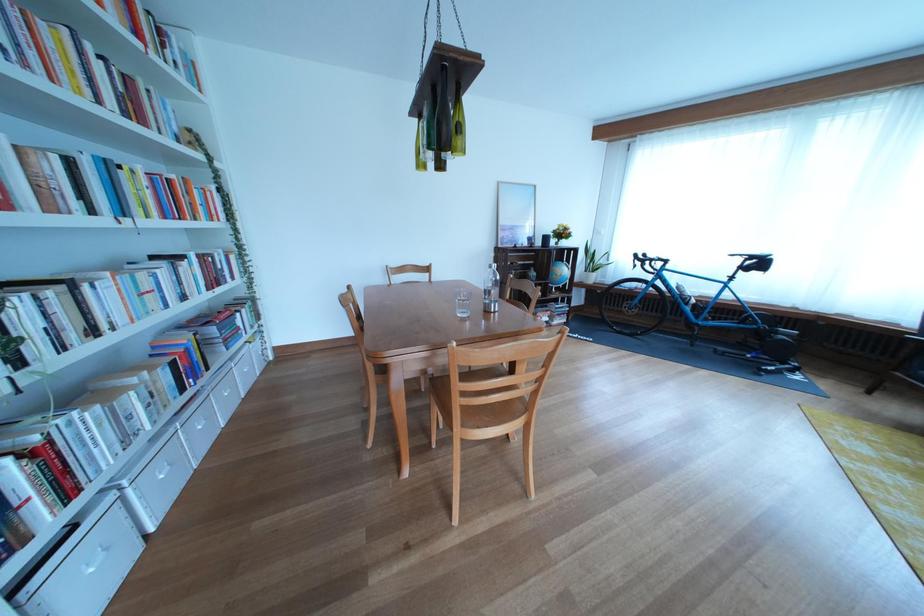
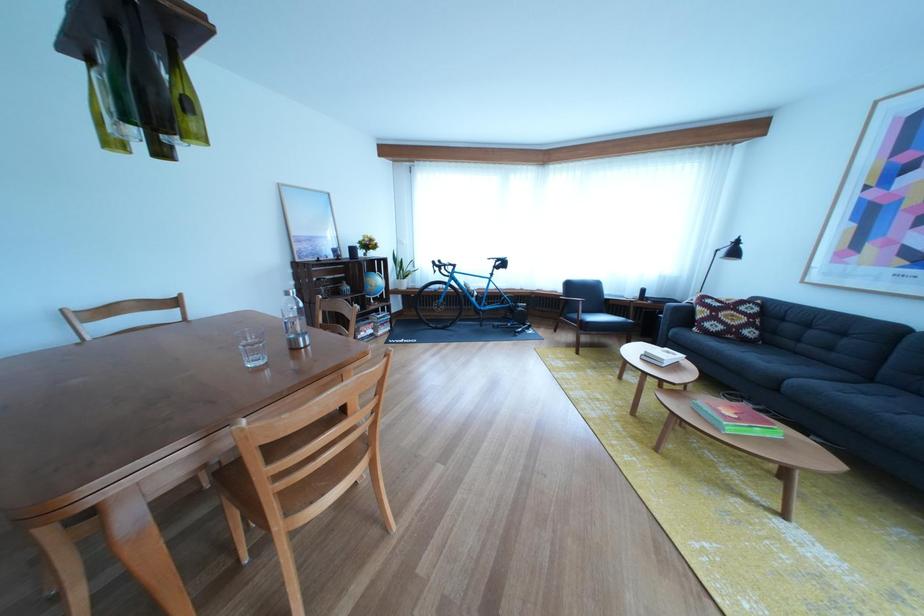
Find the pixel in the second image that matches (552,283) in the first image.

(367, 297)